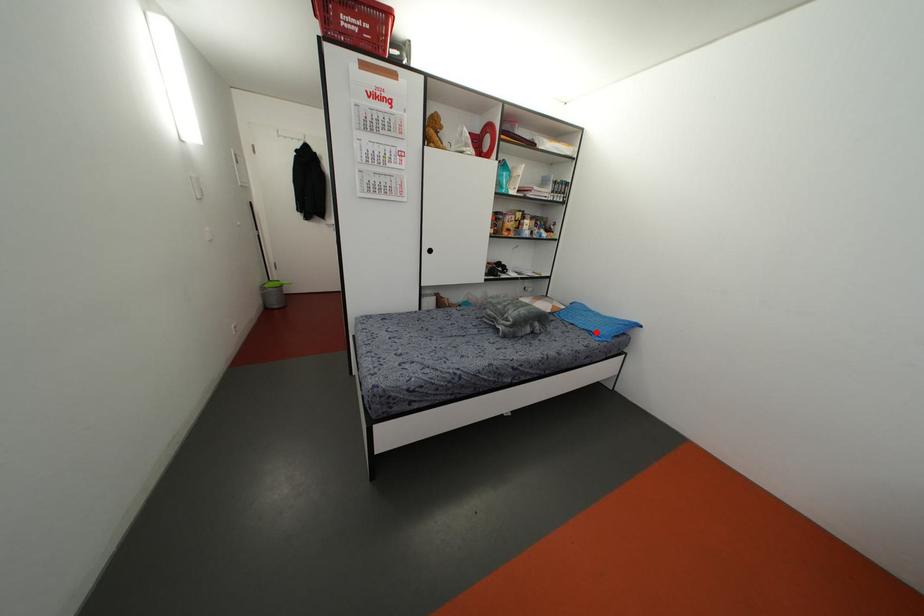
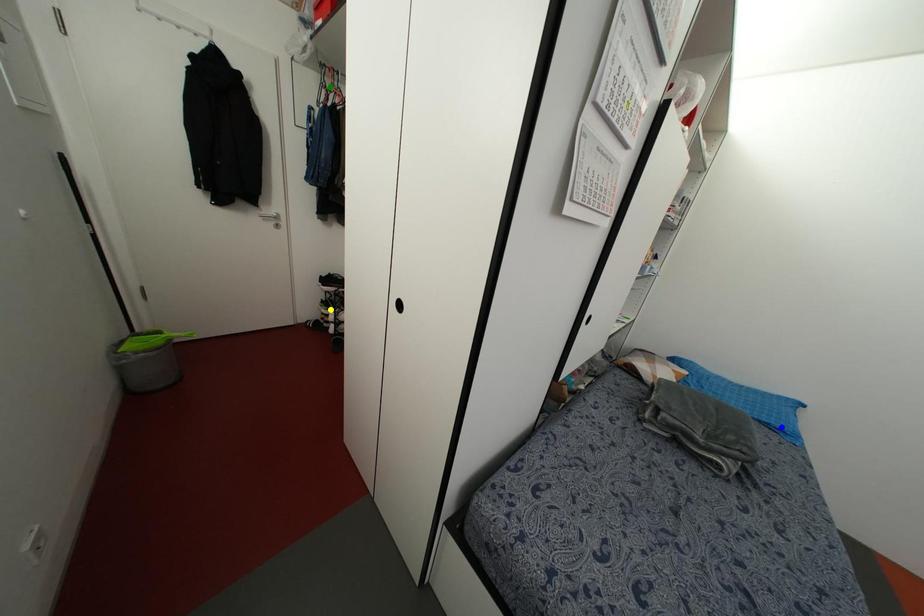
Question: I am providing you with two images of the same scene from different viewpoints. A red point is marked on the first image. You are given multiple points on the second image. Which point in image 2 represents the same 3d spot as the red point in image 1?

Choices:
 (A) green point
 (B) yellow point
 (C) blue point

Answer: (C)